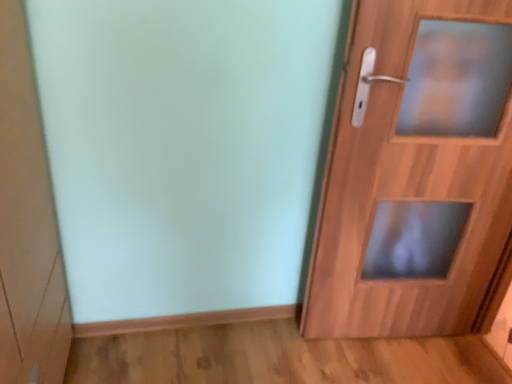
Question: Can you confirm if wooden door at right is taller than matte white cabinet at left?

Choices:
 (A) yes
 (B) no

Answer: (A)

Question: Is wooden door at right not near matte white cabinet at left?

Choices:
 (A) yes
 (B) no

Answer: (A)

Question: Does wooden door at right lie in front of matte white cabinet at left?

Choices:
 (A) no
 (B) yes

Answer: (A)

Question: Can you confirm if wooden door at right is wider than matte white cabinet at left?

Choices:
 (A) no
 (B) yes

Answer: (A)

Question: Can you confirm if wooden door at right is positioned to the right of matte white cabinet at left?

Choices:
 (A) yes
 (B) no

Answer: (A)

Question: From a real-world perspective, is wooden door at right positioned over matte white cabinet at left based on gravity?

Choices:
 (A) no
 (B) yes

Answer: (B)

Question: Could you tell me if matte white cabinet at left is facing wooden door at right?

Choices:
 (A) no
 (B) yes

Answer: (B)

Question: Is matte white cabinet at left not near wooden door at right?

Choices:
 (A) no
 (B) yes

Answer: (B)

Question: Considering the relative positions of matte white cabinet at left and wooden door at right in the image provided, is matte white cabinet at left behind wooden door at right?

Choices:
 (A) no
 (B) yes

Answer: (A)

Question: Considering the relative sizes of matte white cabinet at left and wooden door at right in the image provided, is matte white cabinet at left smaller than wooden door at right?

Choices:
 (A) no
 (B) yes

Answer: (B)

Question: Is matte white cabinet at left completely or partially outside of wooden door at right?

Choices:
 (A) yes
 (B) no

Answer: (A)

Question: Is matte white cabinet at left positioned before wooden door at right?

Choices:
 (A) no
 (B) yes

Answer: (B)

Question: Relative to wooden door at right, is matte white cabinet at left in front or behind?

Choices:
 (A) behind
 (B) front

Answer: (B)